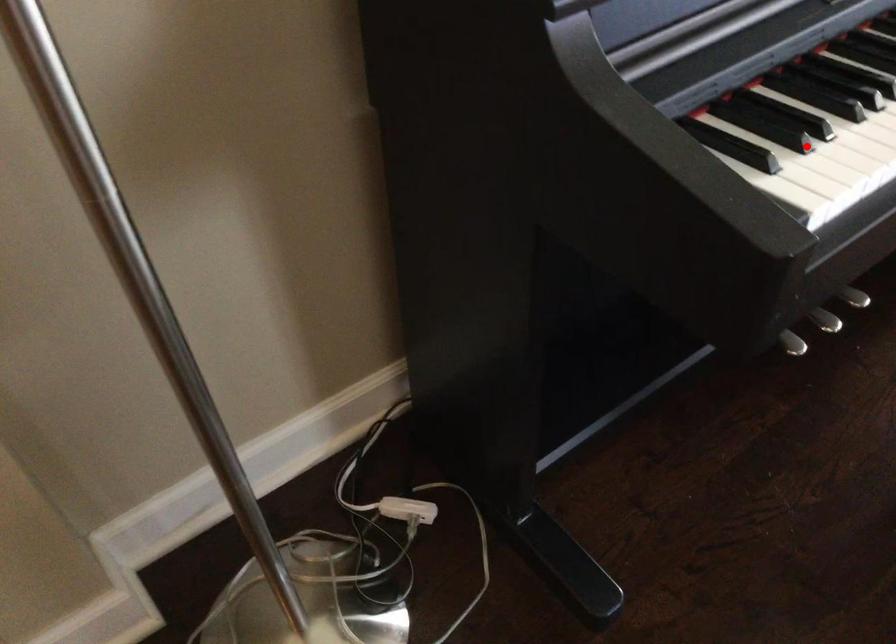
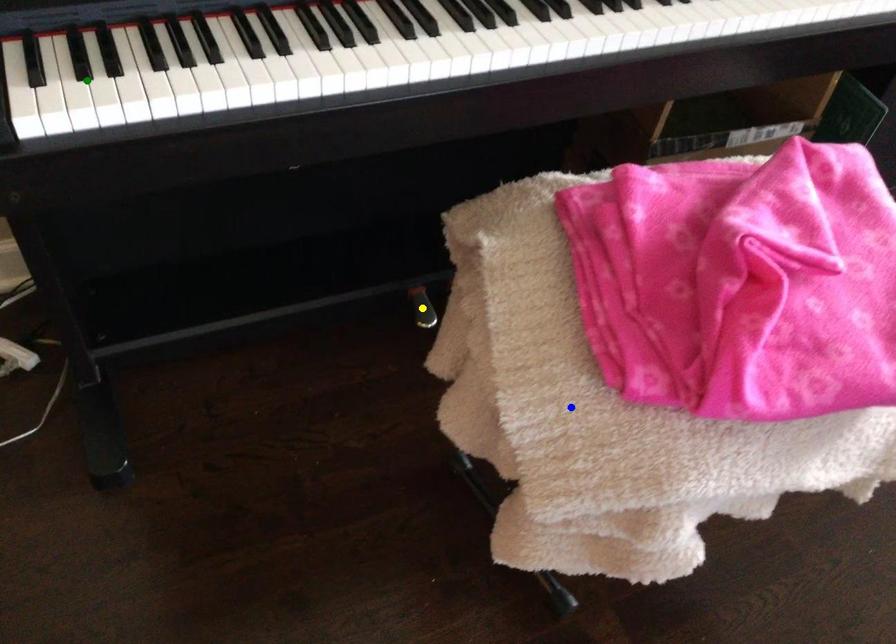
Question: I am providing you with two images of the same scene from different viewpoints. A red point is marked on the first image. You are given multiple points on the second image. Can you choose the point in image 2 that corresponds to the point in image 1?

Choices:
 (A) blue point
 (B) green point
 (C) yellow point

Answer: (B)